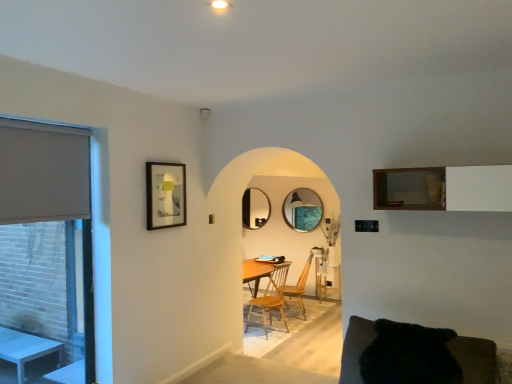
Question: Are black fuzzy couch at lower right and matte glass mirror at center, placed as the 2th mirror when sorted from back to front, located far from each other?

Choices:
 (A) yes
 (B) no

Answer: (A)

Question: Considering the relative sizes of black fuzzy couch at lower right and matte glass mirror at center, placed as the 2th mirror when sorted from back to front, in the image provided, is black fuzzy couch at lower right taller than matte glass mirror at center, placed as the 2th mirror when sorted from back to front,?

Choices:
 (A) yes
 (B) no

Answer: (B)

Question: Is black fuzzy couch at lower right located outside matte glass mirror at center, which is the first mirror from front to back?

Choices:
 (A) no
 (B) yes

Answer: (B)

Question: Is matte glass mirror at center, marked as the 1th mirror in a right-to-left arrangement, completely or partially inside black fuzzy couch at lower right?

Choices:
 (A) no
 (B) yes

Answer: (A)

Question: Considering the relative positions of black fuzzy couch at lower right and matte glass mirror at center, which ranks as the second mirror in left-to-right order, in the image provided, is black fuzzy couch at lower right behind matte glass mirror at center, which ranks as the second mirror in left-to-right order,?

Choices:
 (A) yes
 (B) no

Answer: (B)

Question: From the image's perspective, is beige fabric window at left above or below matte gray roller blind at left?

Choices:
 (A) below
 (B) above

Answer: (A)

Question: Would you say beige fabric window at left is to the left or to the right of matte gray roller blind at left in the picture?

Choices:
 (A) right
 (B) left

Answer: (B)

Question: From a real-world perspective, is beige fabric window at left positioned above or below matte gray roller blind at left?

Choices:
 (A) below
 (B) above

Answer: (A)

Question: Considering their positions, is beige fabric window at left located in front of or behind matte gray roller blind at left?

Choices:
 (A) behind
 (B) front

Answer: (A)

Question: Is wooden framed artwork at upper left taller or shorter than wooden chair at center, the first chair positioned from the back?

Choices:
 (A) short
 (B) tall

Answer: (A)

Question: Considering the positions of wooden framed artwork at upper left and wooden chair at center, the first chair positioned from the back, in the image, is wooden framed artwork at upper left bigger or smaller than wooden chair at center, the first chair positioned from the back,?

Choices:
 (A) small
 (B) big

Answer: (A)

Question: In the image, is wooden framed artwork at upper left on the left side or the right side of wooden chair at center, which is the 2th chair from front to back?

Choices:
 (A) right
 (B) left

Answer: (B)

Question: Choose the correct answer: Is wooden framed artwork at upper left inside wooden chair at center, the first chair positioned from the back, or outside it?

Choices:
 (A) outside
 (B) inside

Answer: (A)

Question: From the image's perspective, is matte glass mirror at center, marked as the 1th mirror in a right-to-left arrangement, above or below beige fabric window at left?

Choices:
 (A) above
 (B) below

Answer: (A)

Question: Is matte glass mirror at center, which ranks as the second mirror in left-to-right order, bigger or smaller than beige fabric window at left?

Choices:
 (A) small
 (B) big

Answer: (B)